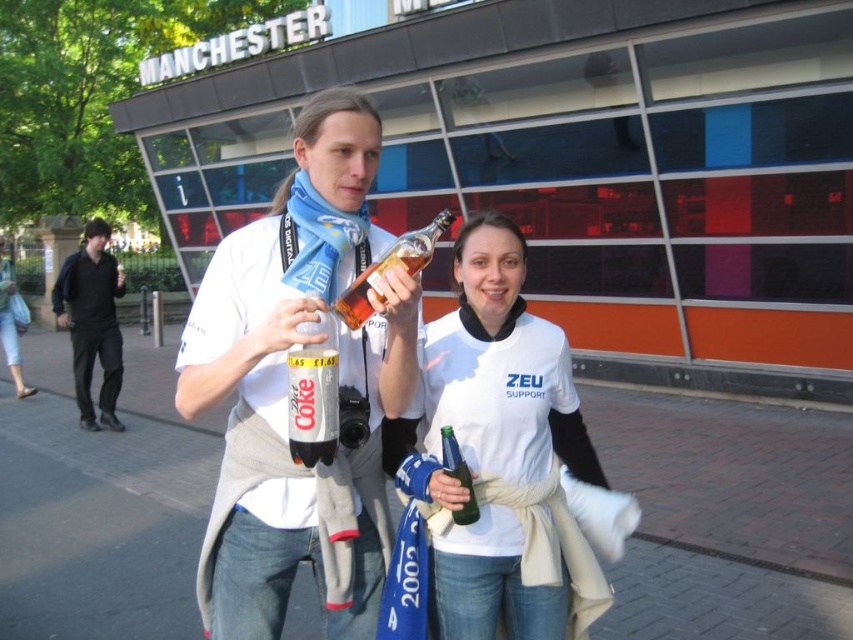
Question: Can you confirm if matte plastic bottle at center is positioned to the right of black cotton jacket at left?

Choices:
 (A) yes
 (B) no

Answer: (A)

Question: Can you confirm if matte plastic bottle at center is positioned below white matte shirt at center?

Choices:
 (A) yes
 (B) no

Answer: (B)

Question: Which object is closer to the camera taking this photo?

Choices:
 (A) black cotton jacket at left
 (B) translucent glass bottle at center
 (C) matte plastic bottle at center
 (D) white matte shirt at center

Answer: (C)

Question: Where is black cotton jacket at left located in relation to translucent glass bottle at center in the image?

Choices:
 (A) right
 (B) left

Answer: (B)

Question: Which object appears farthest from the camera in this image?

Choices:
 (A) green glass bottle at center
 (B) white matte shirt at center
 (C) translucent glass bottle at center
 (D) matte plastic bottle at center

Answer: (A)

Question: Which point is farther from the camera taking this photo?

Choices:
 (A) (78, 364)
 (B) (444, 397)
 (C) (412, 248)
 (D) (300, 278)

Answer: (A)